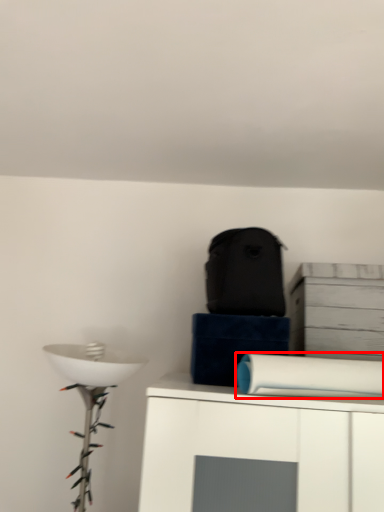
Question: In this image, where is toilet paper (annotated by the red box) located relative to cabinetry?

Choices:
 (A) right
 (B) left

Answer: (B)